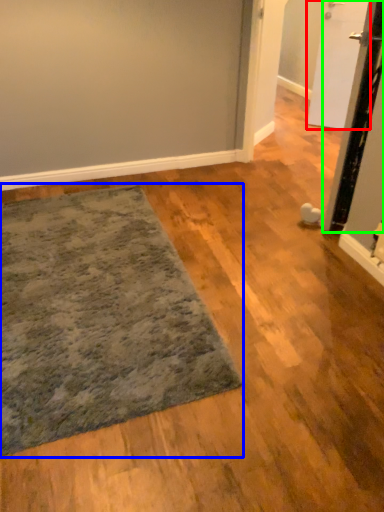
Question: Based on their relative distances, which object is farther from door (highlighted by a red box)? Choose from mat (highlighted by a blue box) and door (highlighted by a green box).

Choices:
 (A) mat
 (B) door

Answer: (A)